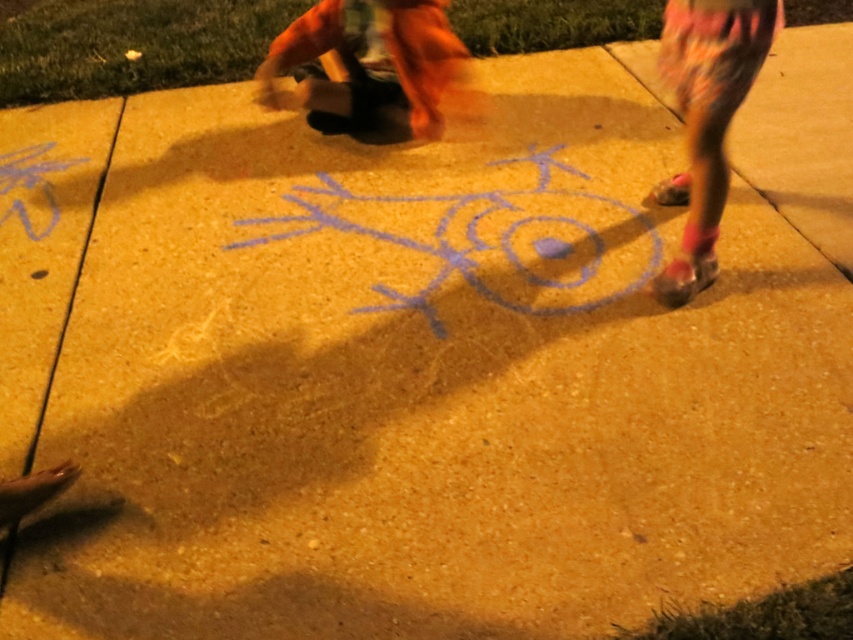
You are standing on the ground looking at the blue chalk drawing. Which of the two items, the orange fabric pants at upper center or the floral leggings at right, is covering the other?

The orange fabric pants at upper center is positioned over floral leggings at right, so it is covering the other.

You are standing in the night scene lit by a streetlamp. You see the blue chalk drawing at center and the floral leggings at right. Which object is closer to you?

The blue chalk drawing at center is closer to you than the floral leggings at right.